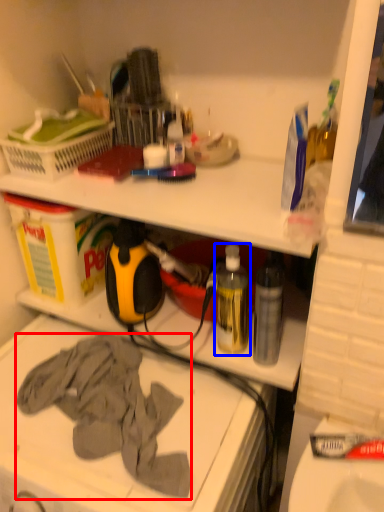
Question: Which object appears closest to the camera in this image, clothing (highlighted by a red box) or bottle (highlighted by a blue box)?

Choices:
 (A) clothing
 (B) bottle

Answer: (A)